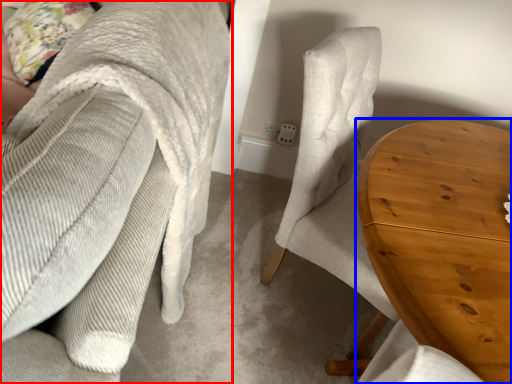
Question: Which point is closer to the camera, chair (highlighted by a red box) or table (highlighted by a blue box)?

Choices:
 (A) chair
 (B) table

Answer: (A)